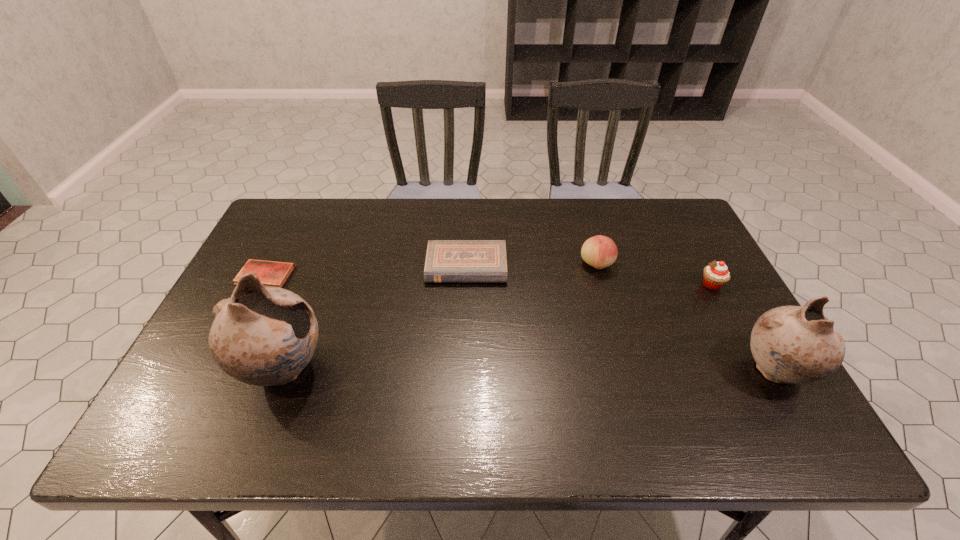
Locate an element on the screen. vacant space at the far edge of the desktop is located at coordinates (521, 222).

Where is `vacant area at the near edge of the desktop`? The image size is (960, 540). vacant area at the near edge of the desktop is located at coordinates (352, 401).

Where is `vacant space at the right edge of the desktop`? The height and width of the screenshot is (540, 960). vacant space at the right edge of the desktop is located at coordinates (682, 261).

In the image, there is a desktop. Where is `vacant space at the far right corner`? This screenshot has height=540, width=960. vacant space at the far right corner is located at coordinates (676, 218).

You are a GUI agent. You are given a task and a screenshot of the screen. Output one action in this format:
    pyautogui.click(x=<x>, y=<y>)
    Task: Click on the free space between the fifth shortest object and the shortest object
    This screenshot has width=960, height=540.
    Given the screenshot: What is the action you would take?
    tap(520, 323)

Locate an element on the screen. free space between the taller pottery and the third object from right to left is located at coordinates (440, 316).

The width and height of the screenshot is (960, 540). In order to click on free space between the peach and the cupcake in this screenshot , I will do `click(654, 274)`.

Identify the location of vacant point located between the second shortest object and the peach. (532, 265).

Identify the location of empty space that is in between the right pottery and the fourth object from left to right. (685, 318).

Find the location of a particular element. The height and width of the screenshot is (540, 960). vacant point located between the fourth object from left to right and the taller pottery is located at coordinates (440, 316).